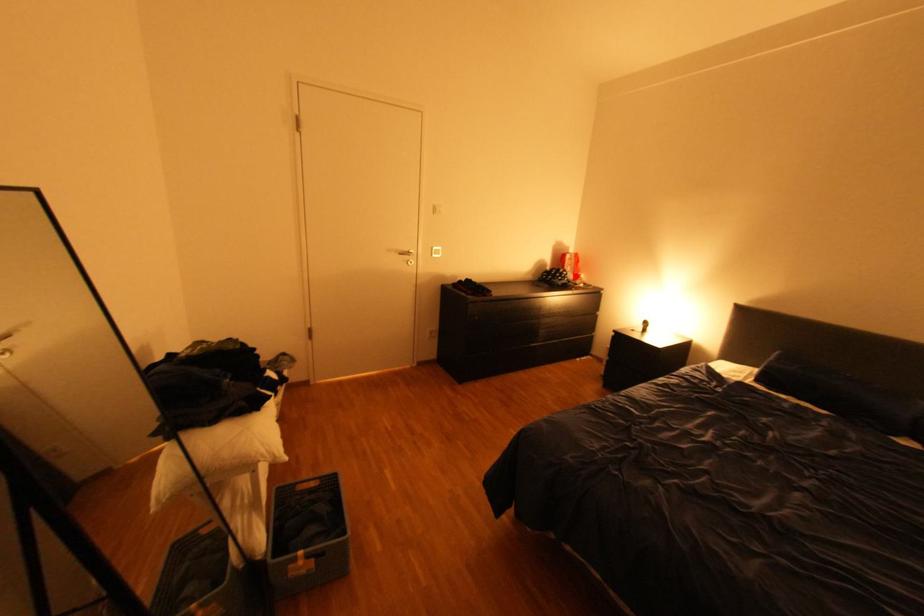
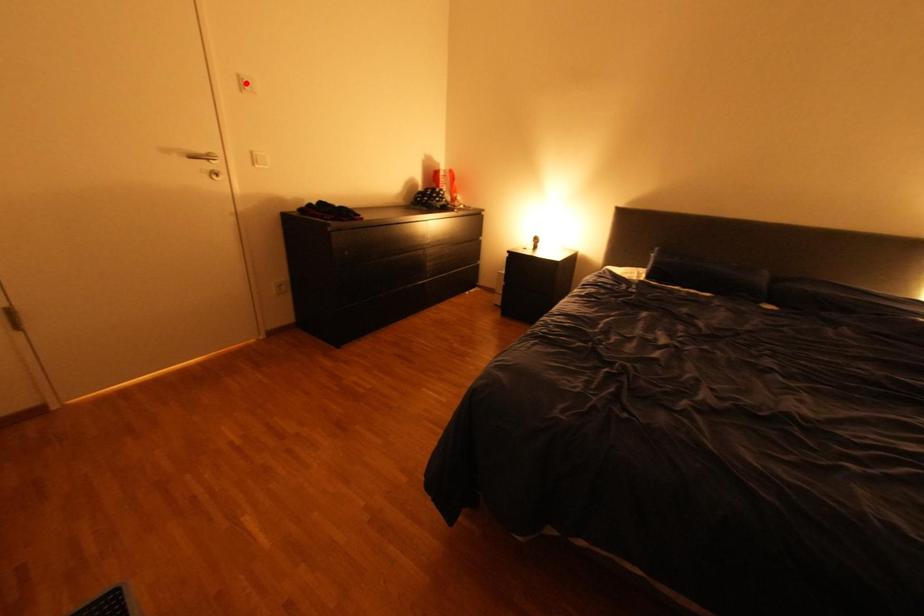
I am providing you with two images of the same scene from different viewpoints. A red point is marked on the first image and another point is marked on the second image. Does the point marked in image1 correspond to the same location as the one in image2?

No